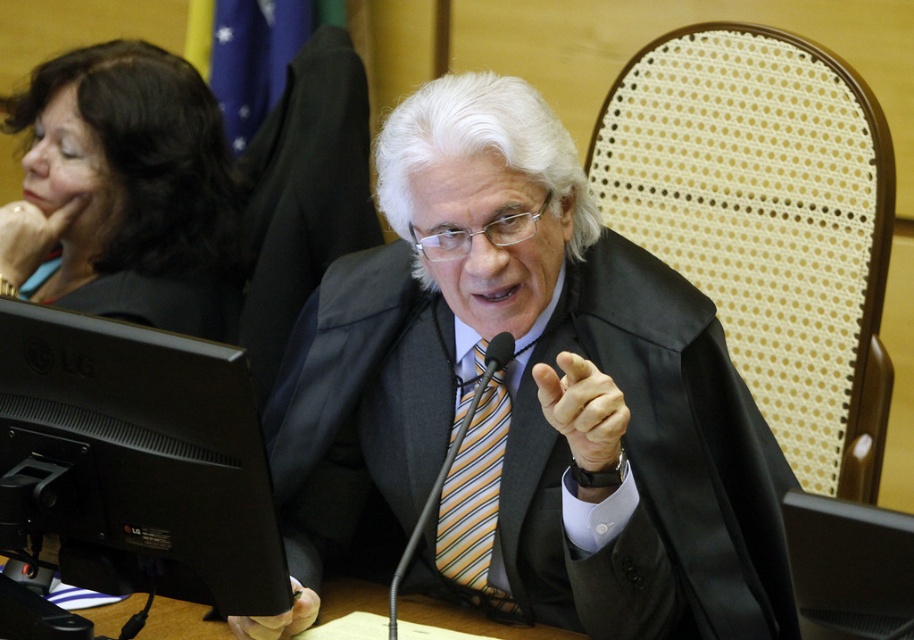
You are organizing a presentation and need to place a laptop on the desk. The laptop requires a space that is taller than the black fabric at upper left. Is the black matte monitor at lower left suitable for placing the laptop?

The black matte monitor at lower left has a lesser height compared to black fabric at upper left, so it is not suitable for placing the laptop as it does not meet the required height.

You are organizing a formal event and need to place a decorative item between the matte black robe at center and the black fabric at upper left. Based on their positions, which object should be placed to the right of the other?

The matte black robe at center should be placed to the right of the black fabric at upper left because the matte black robe at center is positioned on the right side of black fabric at upper left.